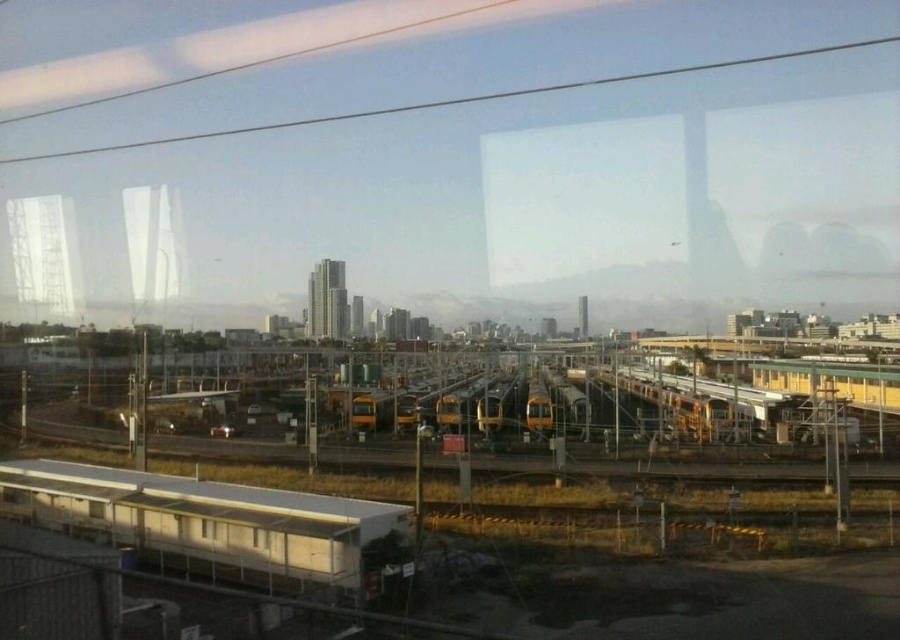
Based on the photo, you are inside the train and want to see the city outside through the transparent glass window at lower center. Is the white matte platform at lower left blocking your view of the city?

The white matte platform at lower left is in front of the transparent glass window at lower center, so it is blocking your view of the city through the window.

You are a passenger sitting inside the train and looking out the window. You notice a white matte platform at lower left located at point (212,522). Can you determine if this platform is closer to the train or further away compared to the dry greenery in the scene?

The white matte platform at lower left located at point (212,522) is closer to the train than the dry greenery in the scene.

You are sitting inside the train and looking out the window. There are two points marked on the window at coordinates point (94, 513) and point (201, 520). Which point is closer to you?

Point (201, 520) is closer to you because it is less further to the camera than point (94, 513).